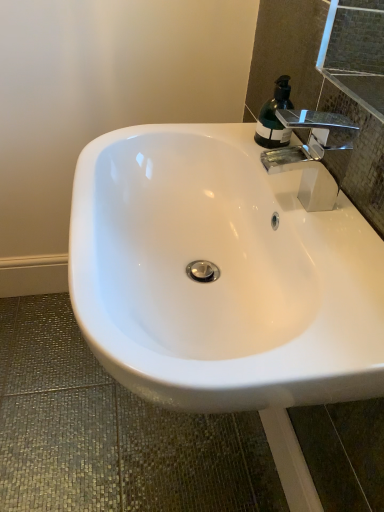
Where is `vacant region in front of chrome/metallic faucet at upper right`? vacant region in front of chrome/metallic faucet at upper right is located at coordinates (331, 258).